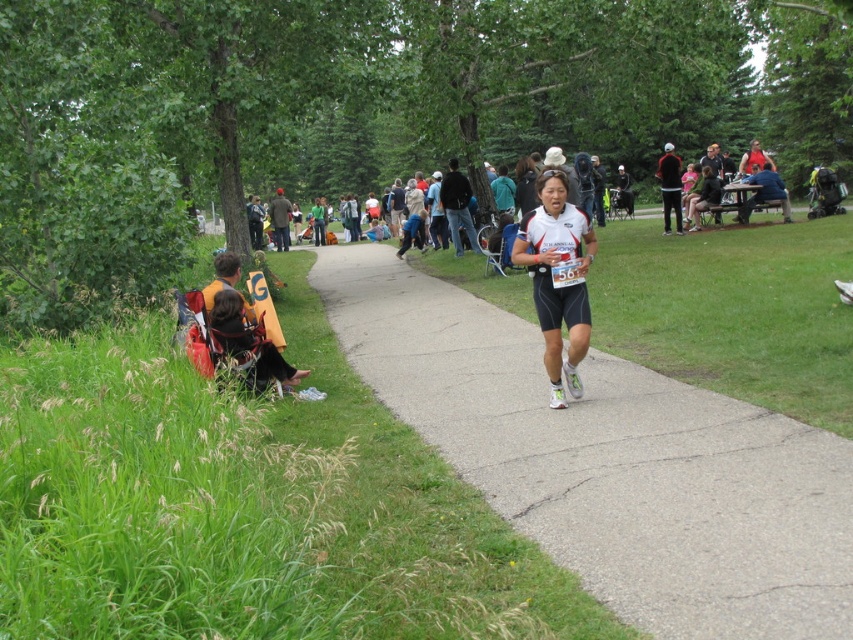
Question: Where is gray asphalt pavement at center located in relation to black matte jacket at upper right in the image?

Choices:
 (A) above
 (B) below

Answer: (B)

Question: Which of the following is the closest to the observer?

Choices:
 (A) (665, 179)
 (B) (410, 316)
 (C) (544, 264)

Answer: (C)

Question: Which point is farther to the camera?

Choices:
 (A) (843, 483)
 (B) (677, 179)

Answer: (B)

Question: Can you confirm if white matte running outfit at center is positioned above black matte jacket at upper right?

Choices:
 (A) no
 (B) yes

Answer: (A)

Question: Which point is closer to the camera taking this photo?

Choices:
 (A) (590, 227)
 (B) (670, 180)
 (C) (657, 442)

Answer: (C)

Question: In this image, where is white matte running outfit at center located relative to black matte jacket at upper right?

Choices:
 (A) above
 (B) below

Answer: (B)